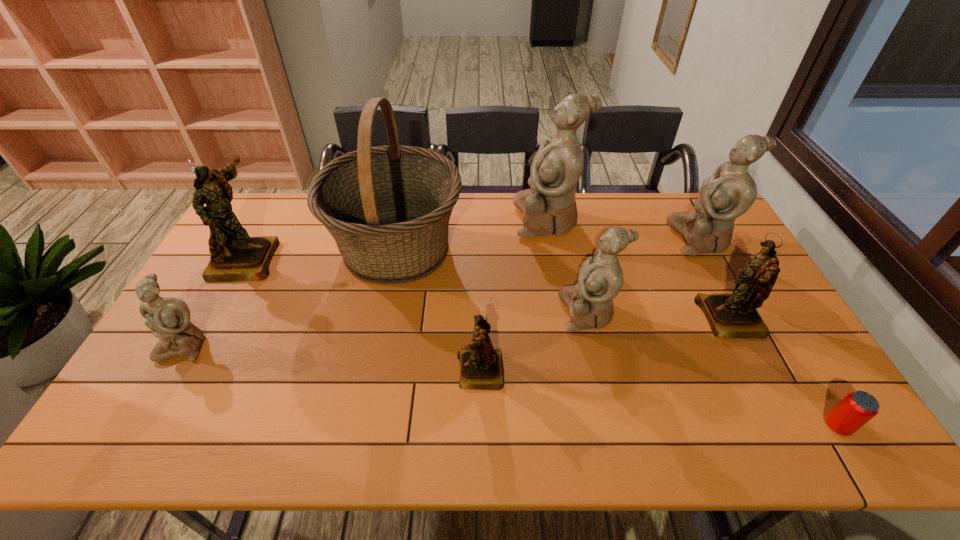
At what (x,y) coordinates should I click in order to perform the action: click on the fifth figurine from right to left. Please return your answer as a coordinate pair (x, y). Looking at the image, I should click on (481, 367).

Where is `the shortest object`? the shortest object is located at coordinates (857, 408).

The height and width of the screenshot is (540, 960). In order to click on the nearest object in this screenshot , I will do `click(857, 408)`.

I want to click on free location located on the right of the basket, so click(x=550, y=248).

Identify the location of vacant space located 0.260m on the front-facing side of the biggest white figurine. The image size is (960, 540). (442, 220).

The height and width of the screenshot is (540, 960). I want to click on vacant space located 0.380m on the front-facing side of the biggest white figurine, so click(408, 220).

Image resolution: width=960 pixels, height=540 pixels. In order to click on blank space located on the front-facing side of the biggest white figurine in this screenshot , I will do `click(475, 220)`.

At what (x,y) coordinates should I click in order to perform the action: click on free spot located 0.250m on the front-facing side of the second biggest white figurine. Please return your answer as a coordinate pair (x, y). This screenshot has width=960, height=540. Looking at the image, I should click on (598, 239).

The height and width of the screenshot is (540, 960). I want to click on vacant space located on the front-facing side of the second biggest white figurine, so click(x=654, y=239).

This screenshot has height=540, width=960. In order to click on vacant space located 0.370m on the front-facing side of the second biggest white figurine in this screenshot , I will do `click(564, 239)`.